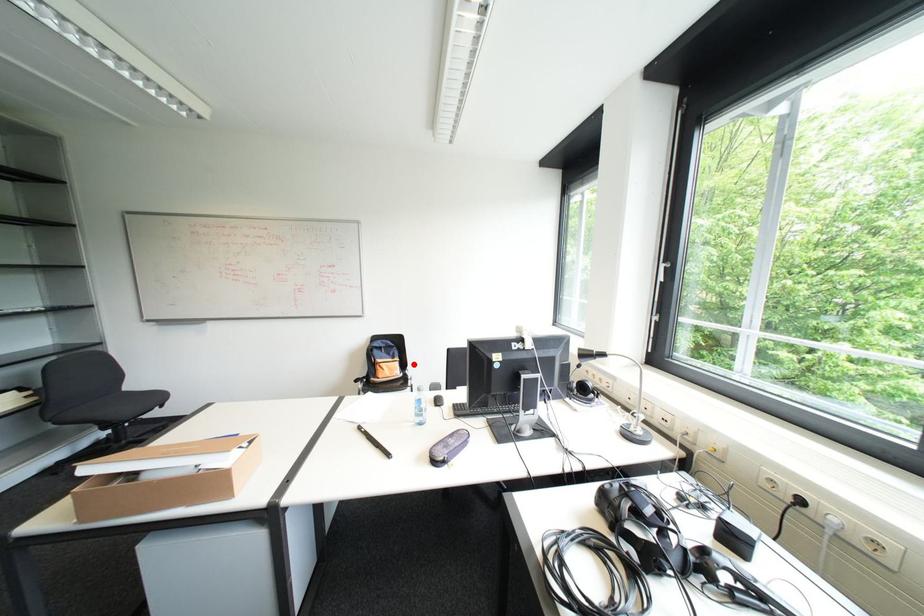
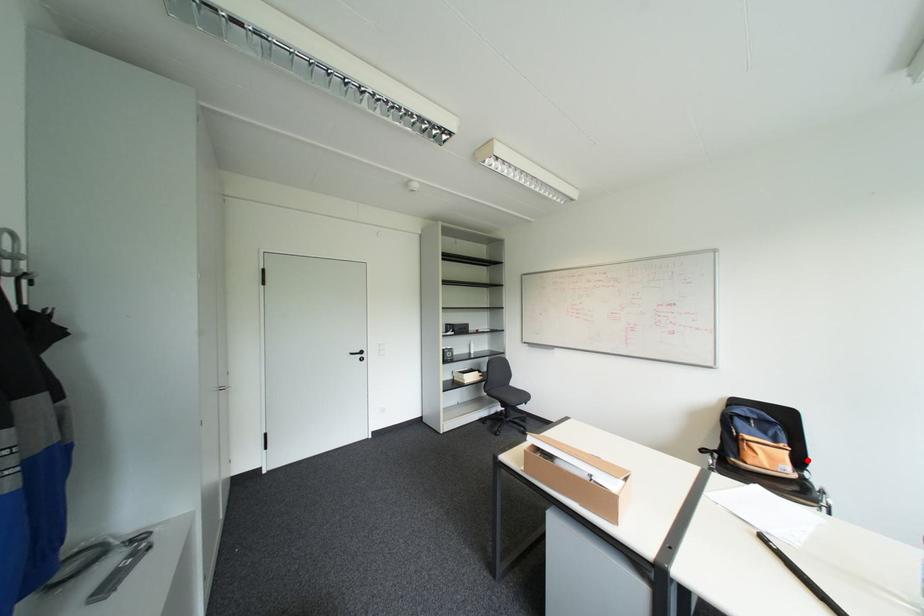
Looking at this image, I am providing you with two images of the same scene from different viewpoints. A red point is marked on the first image and another point is marked on the second image. Is the red point in image1 aligned with the point shown in image2?

Yes